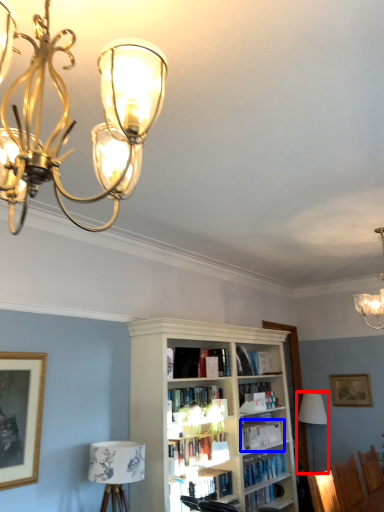
Question: Which point is closer to the camera, table lamp (highlighted by a red box) or book (highlighted by a blue box)?

Choices:
 (A) table lamp
 (B) book

Answer: (B)